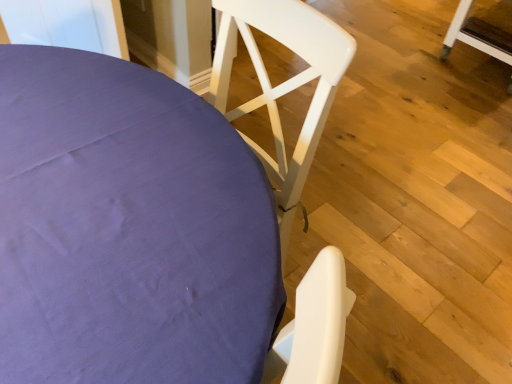
Question: Considering the positions of white wood chair at upper center, which is the first chair from front to back, and white wood chair at upper right, which is the first chair from back to front, in the image, is white wood chair at upper center, which is the first chair from front to back, bigger or smaller than white wood chair at upper right, which is the first chair from back to front,?

Choices:
 (A) small
 (B) big

Answer: (B)

Question: Do you think white wood chair at upper center, which appears as the 2th chair when viewed from the right, is within white wood chair at upper right, positioned as the 2th chair in front-to-back order, or outside of it?

Choices:
 (A) inside
 (B) outside

Answer: (B)

Question: Based on their positions, is white wood chair at upper center, the 1th chair positioned from the left, located to the left or right of white wood chair at upper right, arranged as the 1th chair when viewed from the top?

Choices:
 (A) right
 (B) left

Answer: (B)

Question: Is white wood chair at upper right, placed as the second chair when sorted from left to right, to the left or to the right of white wood chair at upper center, the second chair when ordered from top to bottom, in the image?

Choices:
 (A) left
 (B) right

Answer: (B)

Question: Considering their positions, is white wood chair at upper right, positioned as the 2th chair in front-to-back order, located in front of or behind white wood chair at upper center, the 1th chair when ordered from bottom to top?

Choices:
 (A) front
 (B) behind

Answer: (B)

Question: Is white wood chair at upper right, placed as the second chair when sorted from left to right, inside the boundaries of white wood chair at upper center, which appears as the 2th chair when viewed from the right, or outside?

Choices:
 (A) outside
 (B) inside

Answer: (A)

Question: Considering the positions of white wood chair at upper right, placed as the second chair when sorted from left to right, and white wood chair at upper center, the 1th chair when ordered from bottom to top, in the image, is white wood chair at upper right, placed as the second chair when sorted from left to right, wider or thinner than white wood chair at upper center, the 1th chair when ordered from bottom to top,?

Choices:
 (A) wide
 (B) thin

Answer: (B)